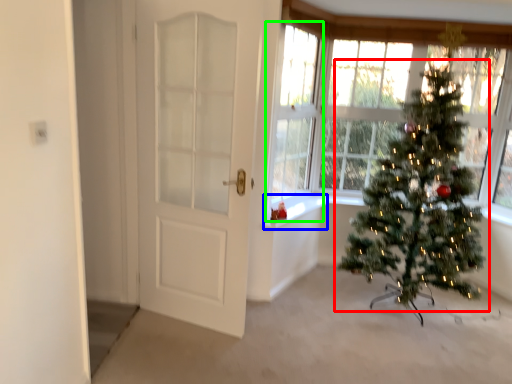
Question: Which object is the closest to the christmas tree (highlighted by a red box)? Choose among these: window sill (highlighted by a blue box) or window (highlighted by a green box).

Choices:
 (A) window sill
 (B) window

Answer: (A)